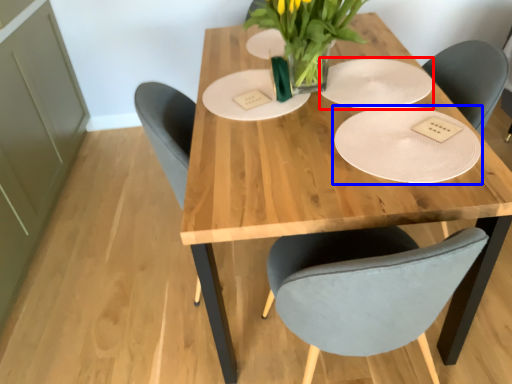
Question: Which object is further to the camera taking this photo, paper plate (highlighted by a red box) or plate (highlighted by a blue box)?

Choices:
 (A) paper plate
 (B) plate

Answer: (A)